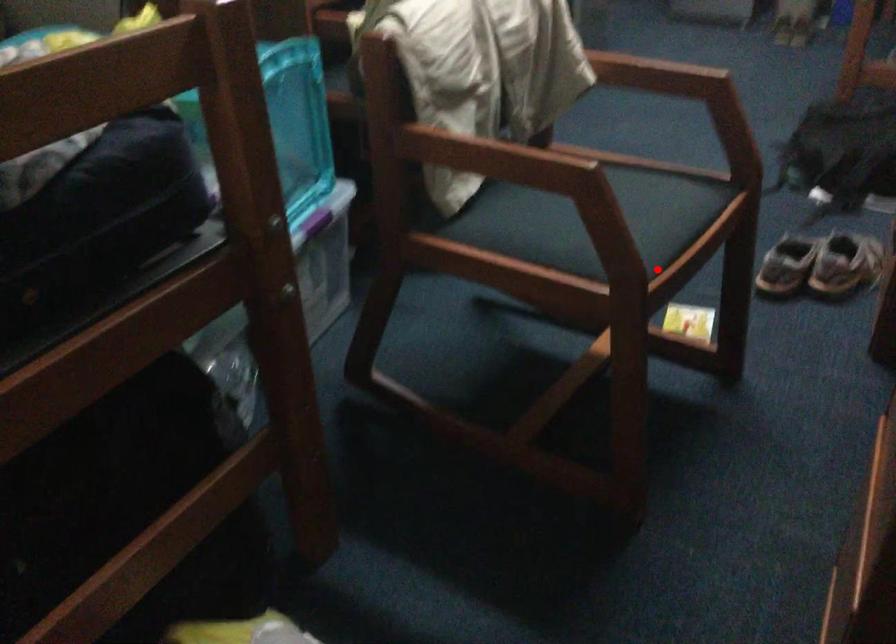
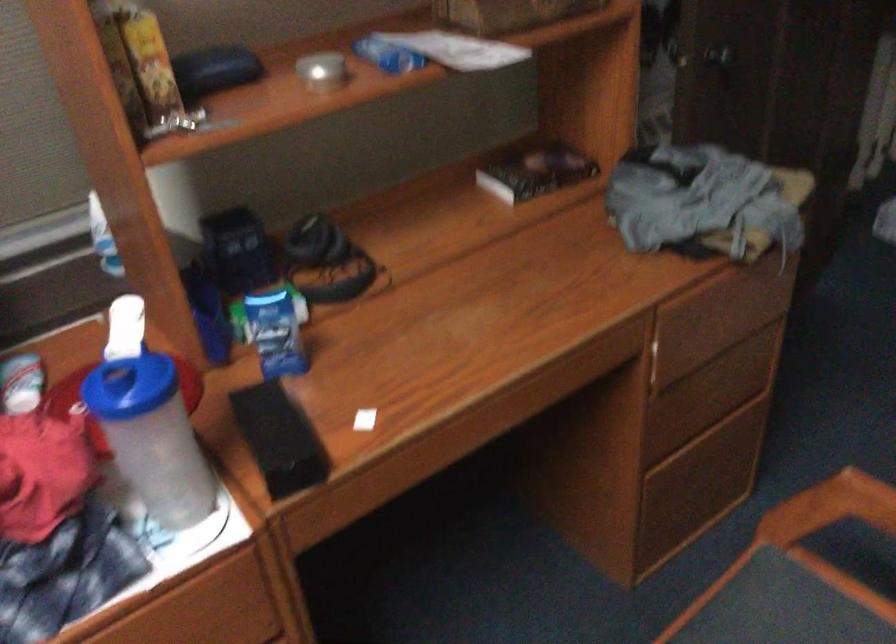
Find the pixel in the second image that matches the highlighted location in the first image.

(780, 614)